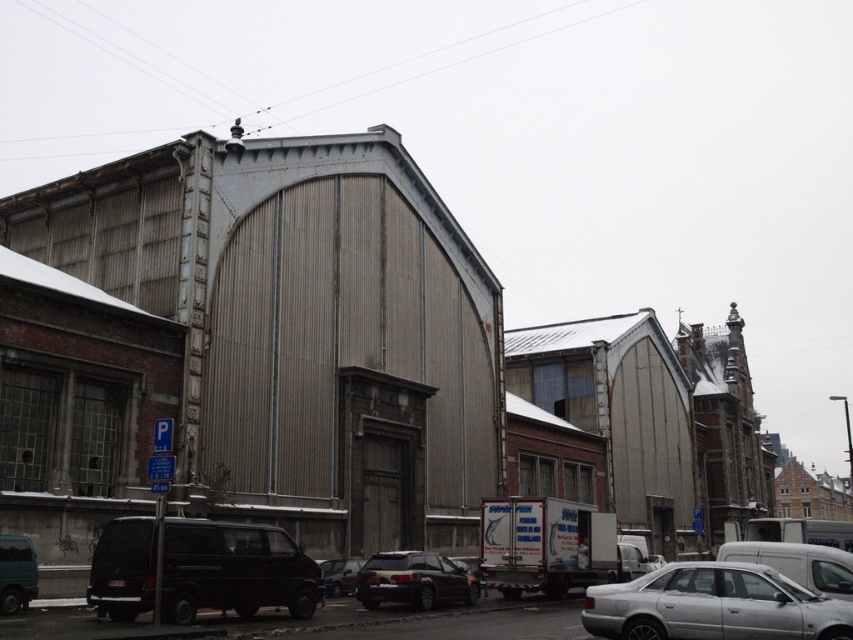
Question: Which point is farther to the camera?

Choices:
 (A) pos(7,540)
 (B) pos(619,595)
 (C) pos(326,560)
 (D) pos(663,560)

Answer: (D)

Question: Which object is positioned farthest from the white matte van at right?

Choices:
 (A) teal matte van at lower left
 (B) black matte van at lower left

Answer: (A)

Question: Does black matte van at lower left come in front of silver metallic car at lower right?

Choices:
 (A) yes
 (B) no

Answer: (B)

Question: Can you confirm if satin black suv at center is bigger than white matte van at lower right?

Choices:
 (A) no
 (B) yes

Answer: (A)

Question: Which of these objects is positioned closest to the shiny black sedan at center?

Choices:
 (A) satin black suv at center
 (B) teal matte van at lower left

Answer: (A)

Question: Is silver metallic car at lower right closer to camera compared to silver metallic sedan at center?

Choices:
 (A) yes
 (B) no

Answer: (A)